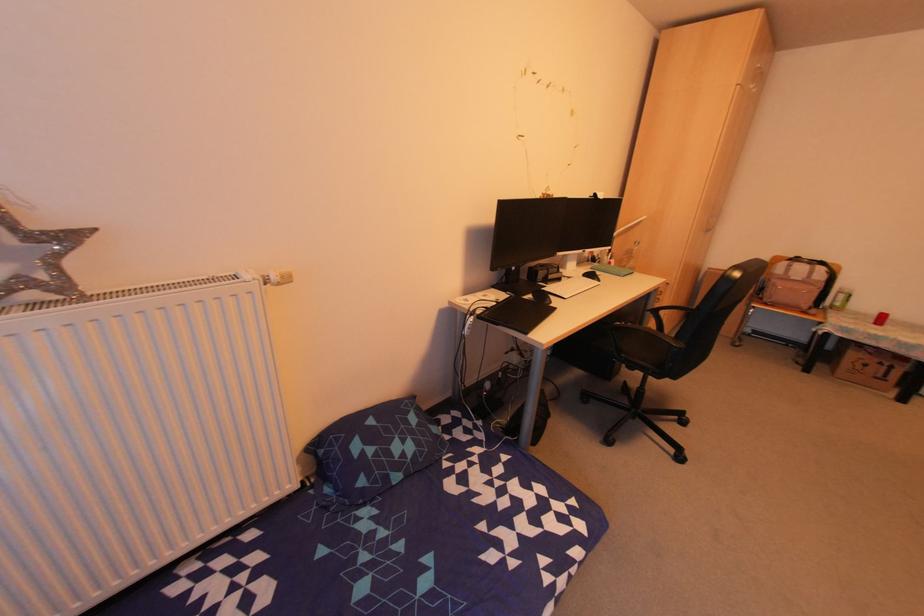
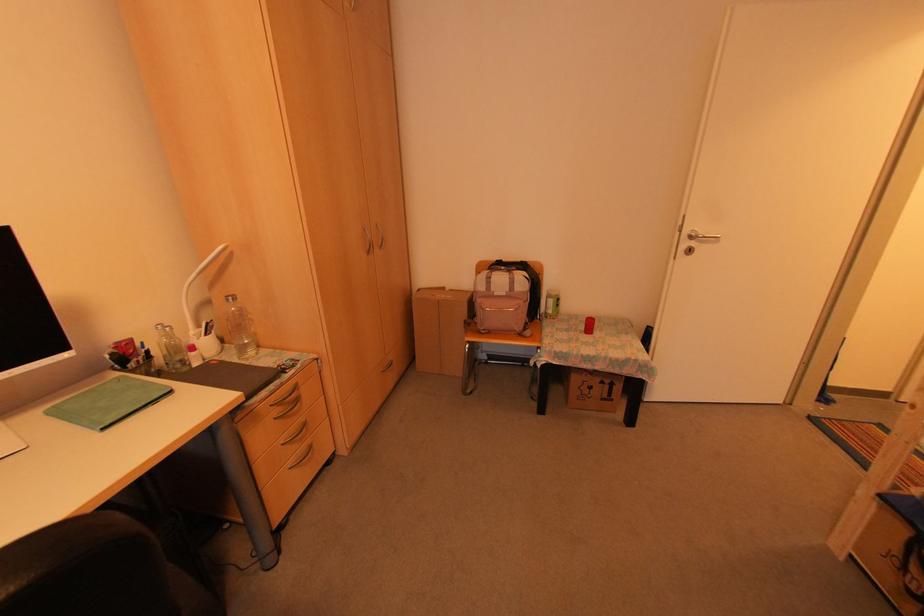
Find the pixel in the second image that matches [877,362] in the first image.

(598, 381)